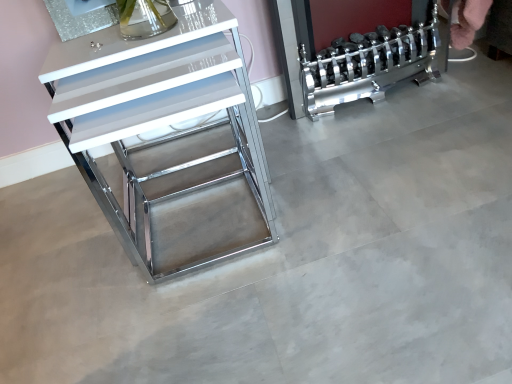
Locate an element on the screen. The height and width of the screenshot is (384, 512). free space in front of chrome metallic dumbbell rack at right is located at coordinates click(399, 144).